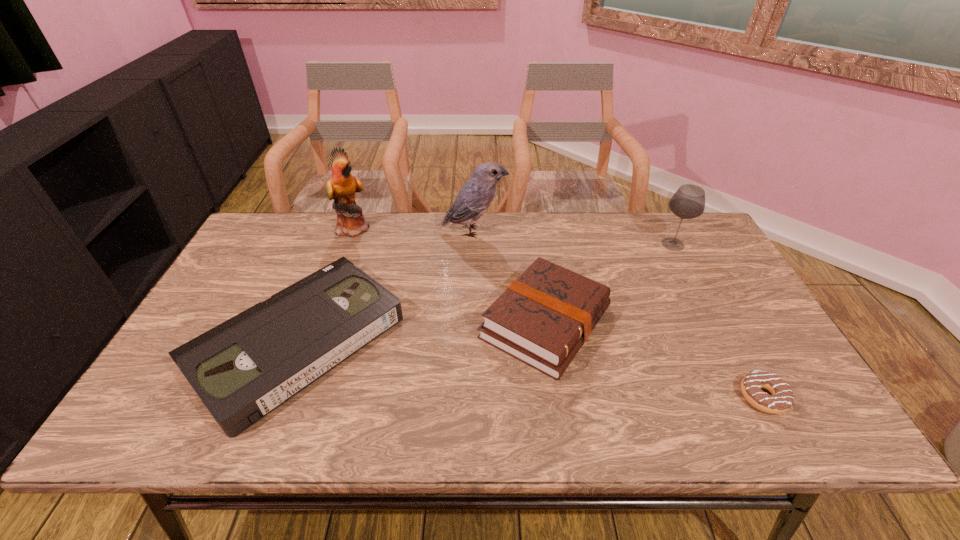
Where is `empty space that is in between the third tallest object and the hardback book`? Image resolution: width=960 pixels, height=540 pixels. empty space that is in between the third tallest object and the hardback book is located at coordinates (610, 284).

This screenshot has height=540, width=960. I want to click on free space between the hardback book and the right parrot, so click(510, 277).

Locate an element on the screen. The width and height of the screenshot is (960, 540). vacant area between the taller parrot and the wineglass is located at coordinates (514, 236).

Choose which object is the second nearest neighbor to the tallest object. Please provide its 2D coordinates. Your answer should be formatted as a tuple, i.e. [(x, y)], where the tuple contains the x and y coordinates of a point satisfying the conditions above.

[(475, 197)]

The image size is (960, 540). In order to click on the second closest object to the tallest object in this screenshot , I will do `click(475, 197)`.

Identify the location of free location that satisfies the following two spatial constraints: 1. on the front-facing side of the doughnut; 2. on the left side of the fifth shortest object. The width and height of the screenshot is (960, 540). (471, 397).

Where is `free space that satisfies the following two spatial constraints: 1. on the front-facing side of the taller parrot; 2. on the left side of the shortest object`? The height and width of the screenshot is (540, 960). free space that satisfies the following two spatial constraints: 1. on the front-facing side of the taller parrot; 2. on the left side of the shortest object is located at coordinates (293, 397).

Find the location of a particular element. free location that satisfies the following two spatial constraints: 1. on the front-facing side of the tallest object; 2. on the right side of the third tallest object is located at coordinates coord(348,245).

Image resolution: width=960 pixels, height=540 pixels. Find the location of `vacant position in the image that satisfies the following two spatial constraints: 1. on the front-facing side of the right parrot; 2. on the right side of the shortest object`. vacant position in the image that satisfies the following two spatial constraints: 1. on the front-facing side of the right parrot; 2. on the right side of the shortest object is located at coordinates (471, 397).

Where is `vacant space that satisfies the following two spatial constraints: 1. on the front-facing side of the shorter parrot; 2. on the back side of the doughnut`? This screenshot has height=540, width=960. vacant space that satisfies the following two spatial constraints: 1. on the front-facing side of the shorter parrot; 2. on the back side of the doughnut is located at coordinates (471, 397).